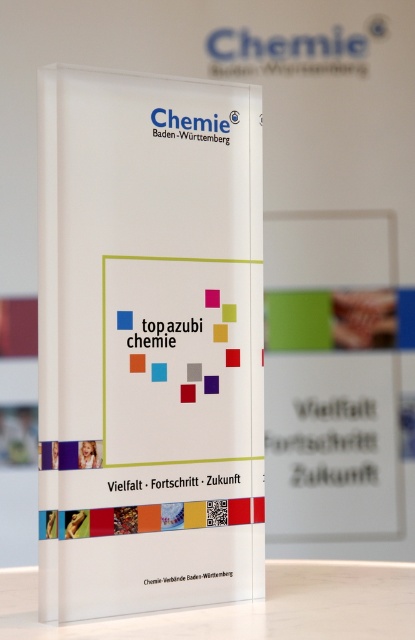
Question: Is white glossy sign at center wider than transparent acrylic table at lower center?

Choices:
 (A) no
 (B) yes

Answer: (A)

Question: Can you confirm if white glossy sign at center is wider than transparent acrylic table at lower center?

Choices:
 (A) yes
 (B) no

Answer: (B)

Question: Where is white glossy sign at center located in relation to transparent acrylic table at lower center in the image?

Choices:
 (A) below
 (B) above

Answer: (B)

Question: Which point is closer to the camera taking this photo?

Choices:
 (A) (282, 625)
 (B) (100, 403)

Answer: (A)

Question: Which point appears closest to the camera in this image?

Choices:
 (A) (202, 241)
 (B) (378, 580)

Answer: (A)

Question: Which object is closer to the camera taking this photo?

Choices:
 (A) transparent acrylic table at lower center
 (B) white glossy sign at center

Answer: (A)